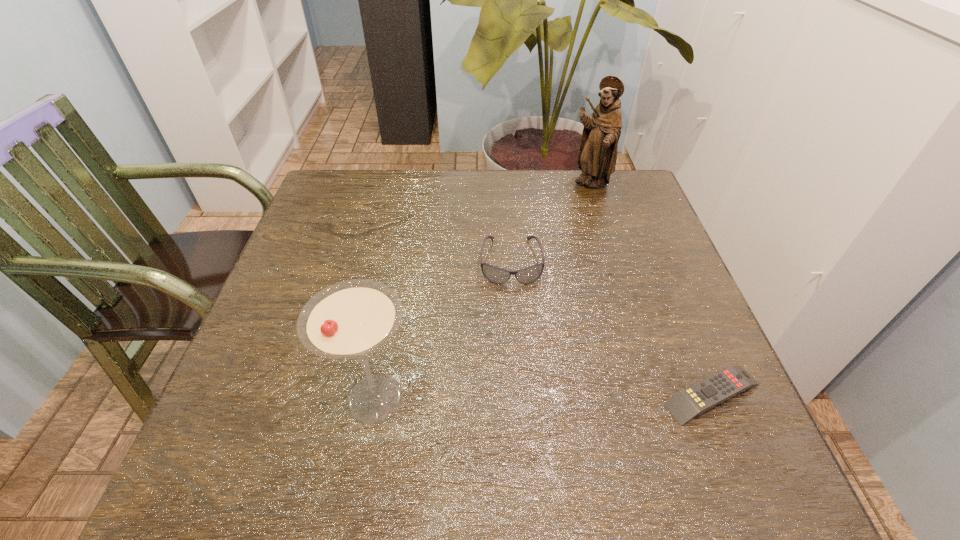
Locate an element on the screen. The height and width of the screenshot is (540, 960). vacant space on the desktop that is between the leftmost object and the shortest object and is positioned on the front-facing side of the tallest object is located at coordinates (564, 396).

Locate an element on the screen. The image size is (960, 540). free spot on the desktop that is between the third shortest object and the remote control and is positioned on the lenses of the third nearest object is located at coordinates (521, 396).